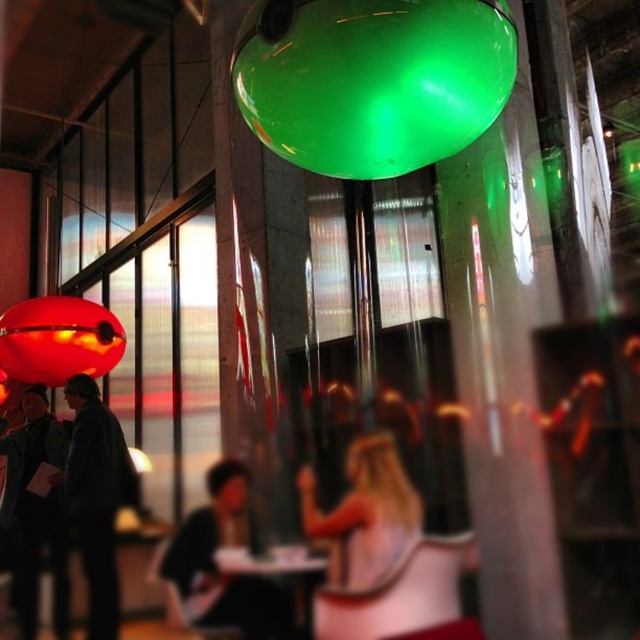
Question: Is dark fabric shirt at center positioned in front of matte red balloon at left?

Choices:
 (A) no
 (B) yes

Answer: (B)

Question: Can you confirm if dark gray jacket at lower left is positioned above matte red balloon at left?

Choices:
 (A) yes
 (B) no

Answer: (B)

Question: Estimate the real-world distances between objects in this image. Which object is farther from the dark fabric shirt at center?

Choices:
 (A) matte red balloon at left
 (B) blonde hair at center
 (C) green translucent sphere at upper center
 (D) dark gray jacket at left

Answer: (C)

Question: Which of the following is the farthest from the observer?

Choices:
 (A) (406, 497)
 (B) (67, 305)

Answer: (B)

Question: Which is farther from the dark gray jacket at lower left?

Choices:
 (A) blonde hair at center
 (B) dark gray jacket at left

Answer: (A)

Question: Is green translucent sphere at upper center in front of dark gray jacket at lower left?

Choices:
 (A) yes
 (B) no

Answer: (A)